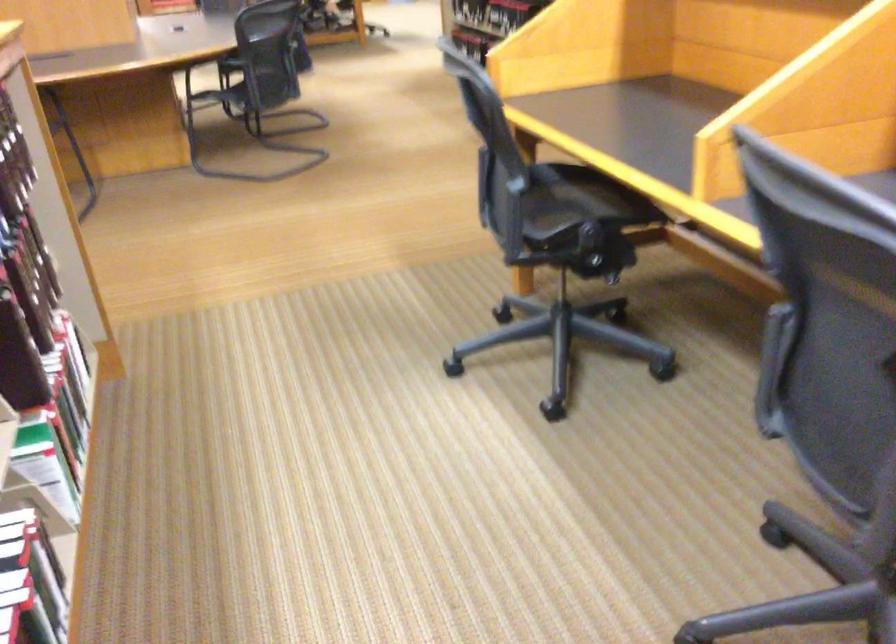
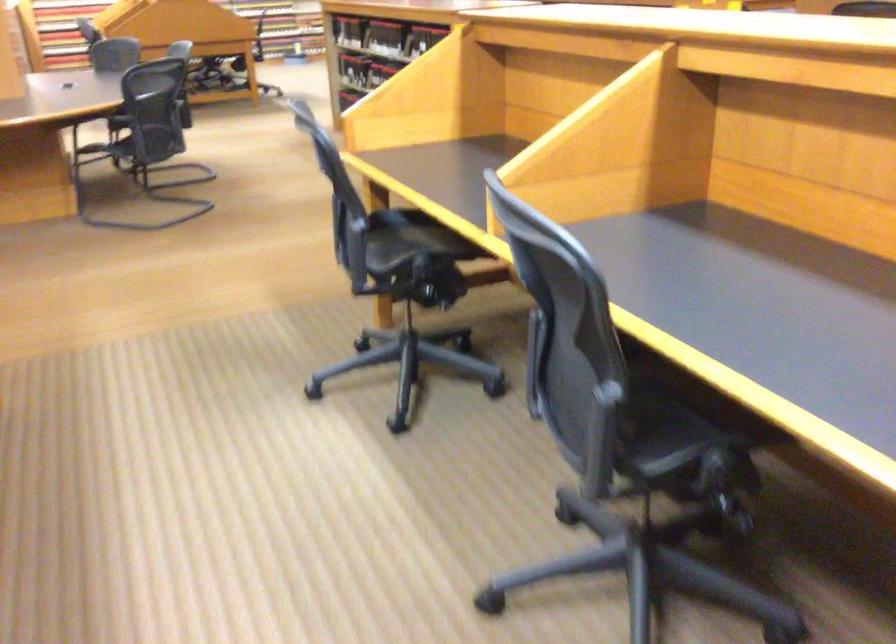
The images are taken continuously from a first-person perspective. In which direction are you moving?

The cameraman walked toward right, backward.